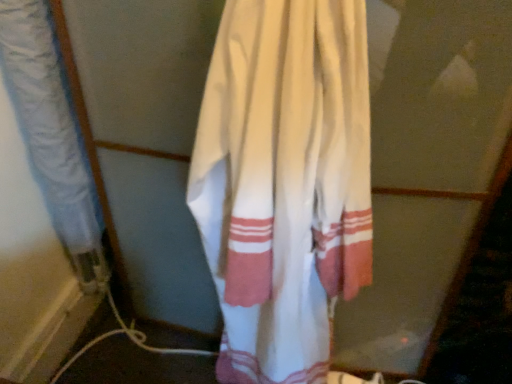
Describe the element at coordinates (51, 134) in the screenshot. The image size is (512, 384). I see `white cotton towel at left, the second curtain viewed from the right` at that location.

Locate an element on the screen. This screenshot has width=512, height=384. white cotton towel at left, the second curtain viewed from the right is located at coordinates (51, 134).

Describe the element at coordinates (284, 181) in the screenshot. Image resolution: width=512 pixels, height=384 pixels. I see `white cotton towel at center, acting as the first curtain starting from the right` at that location.

Image resolution: width=512 pixels, height=384 pixels. What are the coordinates of `white cotton towel at center, acting as the first curtain starting from the right` in the screenshot? It's located at (284, 181).

Measure the distance between point (262,64) and camera.

The depth of point (262,64) is 56.10 centimeters.

Find the location of `white cotton towel at left, the second curtain viewed from the right`. white cotton towel at left, the second curtain viewed from the right is located at coordinates (51, 134).

Between white cotton towel at left, the 1th curtain viewed from the left, and white cotton towel at center, placed as the 2th curtain when sorted from left to right, which one appears on the right side from the viewer's perspective?

white cotton towel at center, placed as the 2th curtain when sorted from left to right.

Considering the relative positions of white cotton towel at left, the 1th curtain viewed from the left, and white cotton towel at center, placed as the 2th curtain when sorted from left to right, in the image provided, is white cotton towel at left, the 1th curtain viewed from the left, in front of white cotton towel at center, placed as the 2th curtain when sorted from left to right,?

No, white cotton towel at left, the 1th curtain viewed from the left, is behind white cotton towel at center, placed as the 2th curtain when sorted from left to right.

Between point (81, 258) and point (209, 176), which one is positioned in front?

Positioned in front is point (209, 176).

From the image's perspective, is white cotton towel at left, the second curtain viewed from the right, over white cotton towel at center, placed as the 2th curtain when sorted from left to right?

Yes, from the image's perspective, white cotton towel at left, the second curtain viewed from the right, is on top of white cotton towel at center, placed as the 2th curtain when sorted from left to right.

From a real-world perspective, who is located higher, white cotton towel at left, the 1th curtain viewed from the left, or white cotton towel at center, placed as the 2th curtain when sorted from left to right?

From a 3D spatial view, white cotton towel at left, the 1th curtain viewed from the left, is above.

Which object is wider, white cotton towel at left, the second curtain viewed from the right, or white cotton towel at center, acting as the first curtain starting from the right?

Wider between the two is white cotton towel at left, the second curtain viewed from the right.

In terms of height, does white cotton towel at left, the 1th curtain viewed from the left, look taller or shorter compared to white cotton towel at center, acting as the first curtain starting from the right?

white cotton towel at left, the 1th curtain viewed from the left, is shorter than white cotton towel at center, acting as the first curtain starting from the right.

Is white cotton towel at left, the second curtain viewed from the right, bigger or smaller than white cotton towel at center, placed as the 2th curtain when sorted from left to right?

white cotton towel at left, the second curtain viewed from the right, is smaller than white cotton towel at center, placed as the 2th curtain when sorted from left to right.

Is white cotton towel at center, acting as the first curtain starting from the right, a part of white cotton towel at left, the second curtain viewed from the right?

That's incorrect, white cotton towel at center, acting as the first curtain starting from the right, is not inside white cotton towel at left, the second curtain viewed from the right.

Are white cotton towel at left, the second curtain viewed from the right, and white cotton towel at center, placed as the 2th curtain when sorted from left to right, beside each other?

No, white cotton towel at left, the second curtain viewed from the right, is not making contact with white cotton towel at center, placed as the 2th curtain when sorted from left to right.

Could you tell me if white cotton towel at left, the second curtain viewed from the right, is turned towards white cotton towel at center, placed as the 2th curtain when sorted from left to right?

No.

In order to click on curtain below the white cotton towel at left, the second curtain viewed from the right (from the image's perspective) in this screenshot , I will do `click(284, 181)`.

Between white cotton towel at center, placed as the 2th curtain when sorted from left to right, and white cotton towel at left, the 1th curtain viewed from the left, which one appears on the right side from the viewer's perspective?

Positioned to the right is white cotton towel at center, placed as the 2th curtain when sorted from left to right.

Between white cotton towel at center, acting as the first curtain starting from the right, and white cotton towel at left, the second curtain viewed from the right, which one is positioned behind?

white cotton towel at left, the second curtain viewed from the right, is behind.

Considering the points (275, 246) and (67, 203), which point is behind, point (275, 246) or point (67, 203)?

The point (67, 203) is more distant.

From the image's perspective, is white cotton towel at center, placed as the 2th curtain when sorted from left to right, located above white cotton towel at left, the 1th curtain viewed from the left?

Incorrect, from the image's perspective, white cotton towel at center, placed as the 2th curtain when sorted from left to right, is lower than white cotton towel at left, the 1th curtain viewed from the left.

From a real-world perspective, is white cotton towel at center, acting as the first curtain starting from the right, physically above white cotton towel at left, the second curtain viewed from the right?

No, from a real-world perspective, white cotton towel at center, acting as the first curtain starting from the right, is not over white cotton towel at left, the second curtain viewed from the right

Which of these two, white cotton towel at center, acting as the first curtain starting from the right, or white cotton towel at left, the second curtain viewed from the right, is wider?

white cotton towel at left, the second curtain viewed from the right, is wider.

Who is taller, white cotton towel at center, placed as the 2th curtain when sorted from left to right, or white cotton towel at left, the second curtain viewed from the right?

white cotton towel at center, placed as the 2th curtain when sorted from left to right.

Is white cotton towel at center, acting as the first curtain starting from the right, bigger or smaller than white cotton towel at left, the 1th curtain viewed from the left?

white cotton towel at center, acting as the first curtain starting from the right, is bigger than white cotton towel at left, the 1th curtain viewed from the left.

Would you say white cotton towel at center, placed as the 2th curtain when sorted from left to right, is inside or outside white cotton towel at left, the second curtain viewed from the right?

white cotton towel at center, placed as the 2th curtain when sorted from left to right, is not enclosed by white cotton towel at left, the second curtain viewed from the right.

Is white cotton towel at center, placed as the 2th curtain when sorted from left to right, far from white cotton towel at left, the second curtain viewed from the right?

white cotton towel at center, placed as the 2th curtain when sorted from left to right, is actually quite close to white cotton towel at left, the second curtain viewed from the right.

From the picture: Could you tell me if white cotton towel at center, acting as the first curtain starting from the right, is facing white cotton towel at left, the second curtain viewed from the right?

No, white cotton towel at center, acting as the first curtain starting from the right, is not facing towards white cotton towel at left, the second curtain viewed from the right.

There is a white cotton towel at center, placed as the 2th curtain when sorted from left to right. Where is `curtain above it (from a real-world perspective)`? curtain above it (from a real-world perspective) is located at coordinates (51, 134).

The width and height of the screenshot is (512, 384). I want to click on curtain beneath the white cotton towel at left, the 1th curtain viewed from the left (from a real-world perspective), so click(284, 181).

Locate an element on the screen. The height and width of the screenshot is (384, 512). curtain on the left of white cotton towel at center, acting as the first curtain starting from the right is located at coordinates (51, 134).